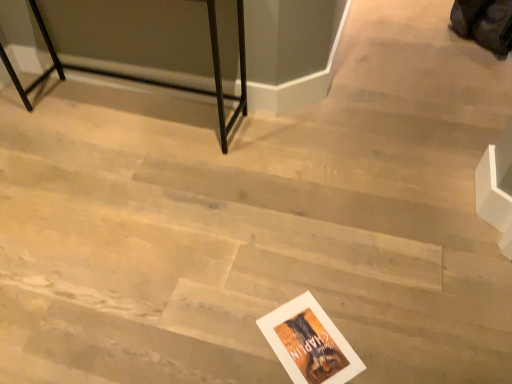
Question: Does black metal table at upper left appear on the right side of white paper postcard at lower center?

Choices:
 (A) no
 (B) yes

Answer: (A)

Question: From a real-world perspective, is black metal table at upper left under white paper postcard at lower center?

Choices:
 (A) no
 (B) yes

Answer: (A)

Question: Is black metal table at upper left at the left side of white paper postcard at lower center?

Choices:
 (A) yes
 (B) no

Answer: (A)

Question: Is black metal table at upper left facing away from white paper postcard at lower center?

Choices:
 (A) no
 (B) yes

Answer: (A)

Question: Can you confirm if black metal table at upper left is thinner than white paper postcard at lower center?

Choices:
 (A) no
 (B) yes

Answer: (A)

Question: Is black metal table at upper left not within white paper postcard at lower center?

Choices:
 (A) no
 (B) yes

Answer: (B)

Question: From a real-world perspective, is white paper postcard at lower center below black metal table at upper left?

Choices:
 (A) yes
 (B) no

Answer: (A)

Question: Is black metal table at upper left located within white paper postcard at lower center?

Choices:
 (A) no
 (B) yes

Answer: (A)

Question: Is white paper postcard at lower center smaller than black metal table at upper left?

Choices:
 (A) yes
 (B) no

Answer: (A)

Question: Are white paper postcard at lower center and black metal table at upper left making contact?

Choices:
 (A) no
 (B) yes

Answer: (A)

Question: Considering the relative sizes of white paper postcard at lower center and black metal table at upper left in the image provided, is white paper postcard at lower center shorter than black metal table at upper left?

Choices:
 (A) yes
 (B) no

Answer: (A)

Question: Considering the relative positions of white paper postcard at lower center and black metal table at upper left in the image provided, is white paper postcard at lower center to the left of black metal table at upper left from the viewer's perspective?

Choices:
 (A) no
 (B) yes

Answer: (A)

Question: Is white paper postcard at lower center to the left or to the right of black metal table at upper left in the image?

Choices:
 (A) left
 (B) right

Answer: (B)